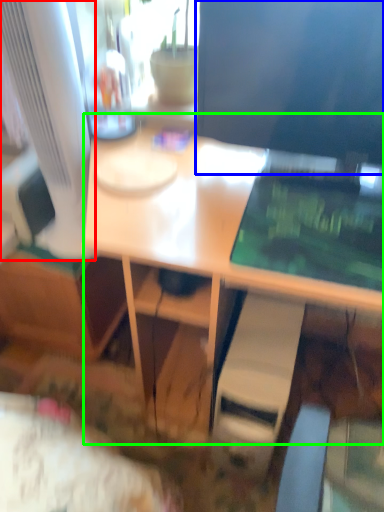
Question: Based on their relative distances, which object is nearer to computer monitor (highlighted by a red box)? Choose from computer monitor (highlighted by a blue box) and desk (highlighted by a green box).

Choices:
 (A) computer monitor
 (B) desk

Answer: (B)